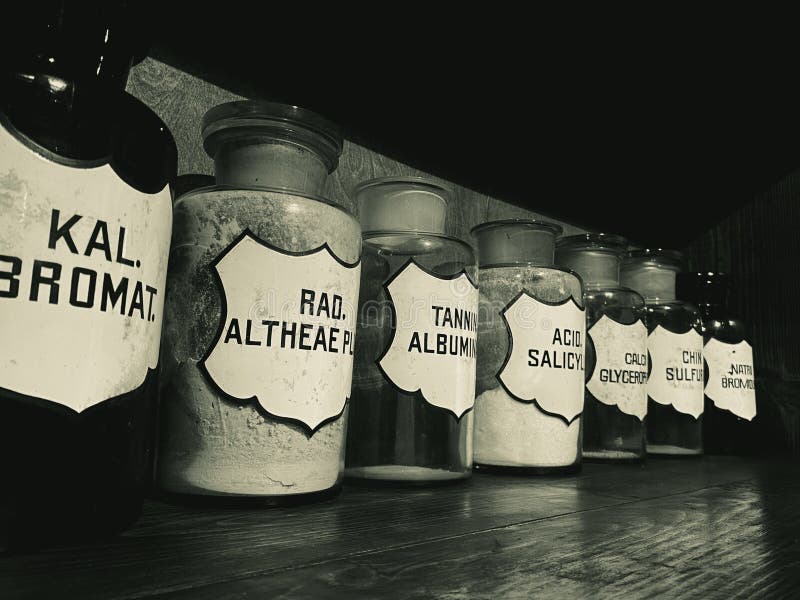
The height and width of the screenshot is (600, 800). Find the location of `clear glass jars`. clear glass jars is located at coordinates (285, 469), (402, 439), (509, 439), (610, 444), (666, 442).